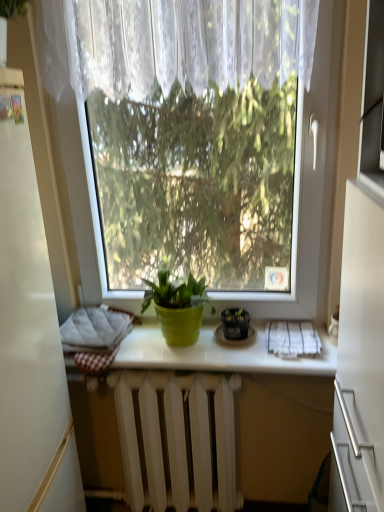
Locate an element on the screen. This screenshot has height=512, width=384. vacant region under green matte pot at center, which is counted as the second houseplant, starting from the right (from a real-world perspective) is located at coordinates (171, 344).